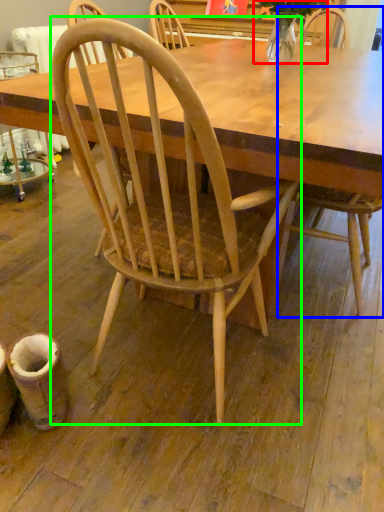
Question: Based on their relative distances, which object is farther from plant (highlighted by a red box)? Choose from chair (highlighted by a blue box) and chair (highlighted by a green box).

Choices:
 (A) chair
 (B) chair

Answer: (B)